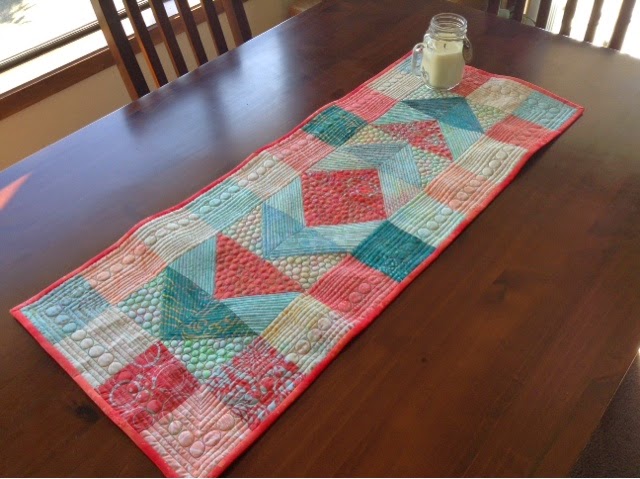
The width and height of the screenshot is (640, 479). What are the coordinates of `table` in the screenshot? It's located at (355, 400).